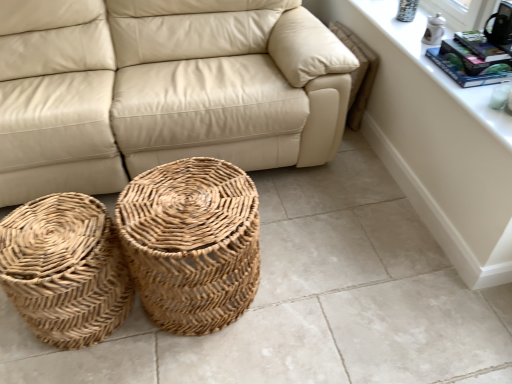
Question: From a real-world perspective, is natural woven basket at center, which is counted as the 2th basket, starting from the left, over natural woven basket at lower left, the 1th basket positioned from the left?

Choices:
 (A) yes
 (B) no

Answer: (A)

Question: Can you confirm if natural woven basket at center, which is counted as the 2th basket, starting from the left, is wider than natural woven basket at lower left, the 1th basket positioned from the left?

Choices:
 (A) no
 (B) yes

Answer: (B)

Question: From a real-world perspective, is natural woven basket at center, which appears as the 1th basket when viewed from the right, physically below natural woven basket at lower left, the second basket from the right?

Choices:
 (A) no
 (B) yes

Answer: (A)

Question: Is natural woven basket at center, which is counted as the 2th basket, starting from the left, touching natural woven basket at lower left, the second basket from the right?

Choices:
 (A) no
 (B) yes

Answer: (A)

Question: Is natural woven basket at lower left, the 1th basket positioned from the left, completely or partially inside natural woven basket at center, which appears as the 1th basket when viewed from the right?

Choices:
 (A) no
 (B) yes

Answer: (A)

Question: Is natural woven basket at center, which is counted as the 2th basket, starting from the left, located outside natural woven basket at lower left, the second basket from the right?

Choices:
 (A) no
 (B) yes

Answer: (B)

Question: Does beige leather couch at center have a smaller size compared to natural woven basket at center, which appears as the 1th basket when viewed from the right?

Choices:
 (A) yes
 (B) no

Answer: (B)

Question: Is beige leather couch at center turned away from natural woven basket at center, which appears as the 1th basket when viewed from the right?

Choices:
 (A) no
 (B) yes

Answer: (A)

Question: Can we say beige leather couch at center lies outside natural woven basket at center, which appears as the 1th basket when viewed from the right?

Choices:
 (A) yes
 (B) no

Answer: (A)

Question: Can you confirm if beige leather couch at center is bigger than natural woven basket at center, which appears as the 1th basket when viewed from the right?

Choices:
 (A) no
 (B) yes

Answer: (B)

Question: Could you tell me if beige leather couch at center is turned towards natural woven basket at center, which is counted as the 2th basket, starting from the left?

Choices:
 (A) no
 (B) yes

Answer: (B)

Question: Considering the relative sizes of beige leather couch at center and natural woven basket at center, which is counted as the 2th basket, starting from the left, in the image provided, is beige leather couch at center thinner than natural woven basket at center, which is counted as the 2th basket, starting from the left,?

Choices:
 (A) yes
 (B) no

Answer: (B)

Question: From a real-world perspective, is white glossy dresser at upper right positioned under white ceramic window sill at upper right based on gravity?

Choices:
 (A) no
 (B) yes

Answer: (B)